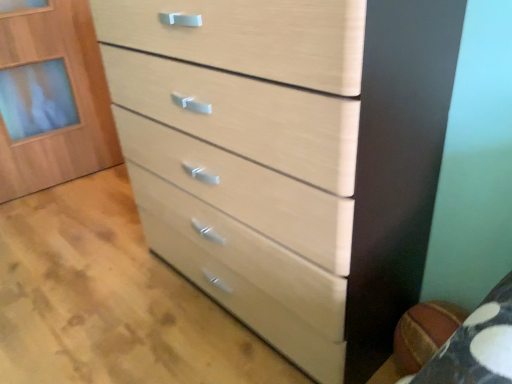
Where is `free space between light wood/texture chest of drawers at center and light wood cabinet at upper left`? The width and height of the screenshot is (512, 384). free space between light wood/texture chest of drawers at center and light wood cabinet at upper left is located at coordinates 96,225.